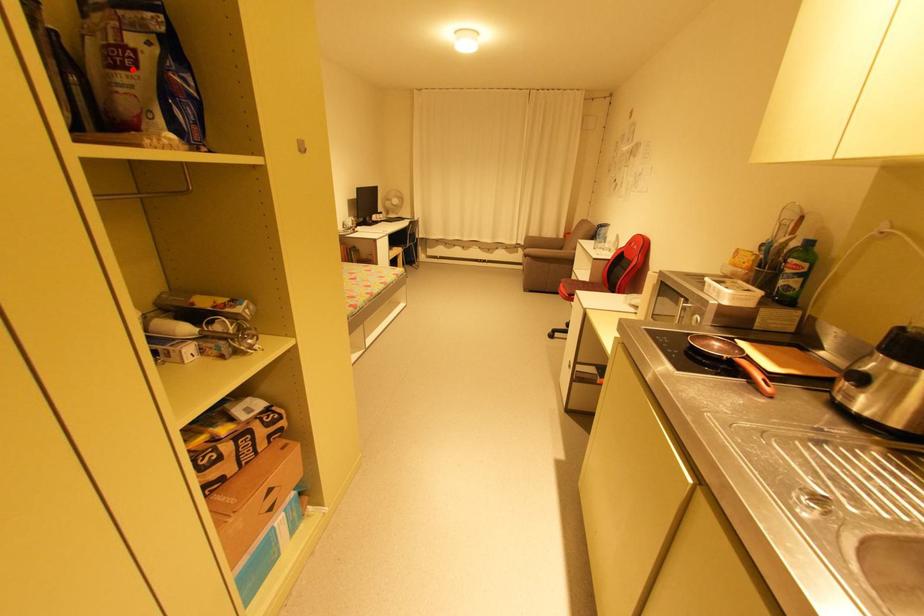
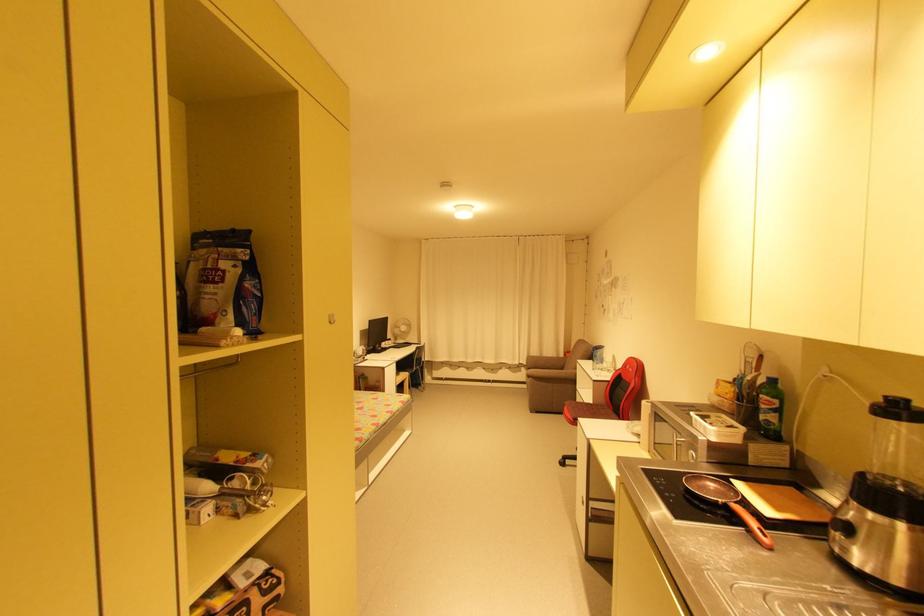
In the second image, find the point that corresponds to the highlighted location in the first image.

(220, 283)